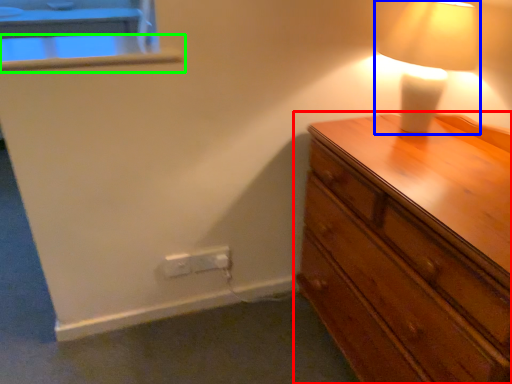
Question: Considering the real-world distances, which object is farthest from chest of drawers (highlighted by a red box)? lamp (highlighted by a blue box) or window sill (highlighted by a green box)?

Choices:
 (A) lamp
 (B) window sill

Answer: (B)